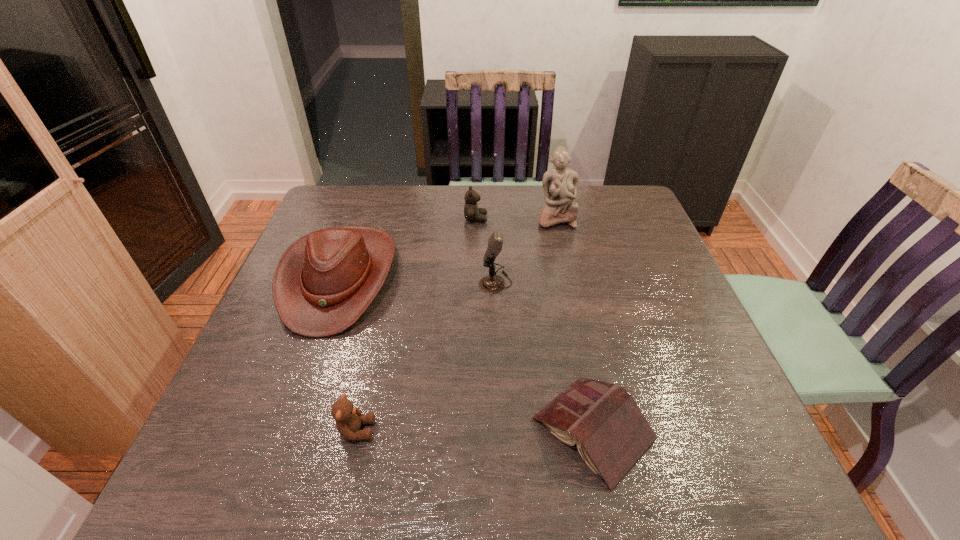
At what (x,y) coordinates should I click in order to perform the action: click on vacant region that satisfies the following two spatial constraints: 1. on the face of the right teddy bear; 2. on the back side of the book. Please return your answer as a coordinate pair (x, y). Looking at the image, I should click on (473, 429).

Find the location of a particular element. blank space that satisfies the following two spatial constraints: 1. on the face of the shortest object; 2. on the left side of the farther teddy bear is located at coordinates (473, 429).